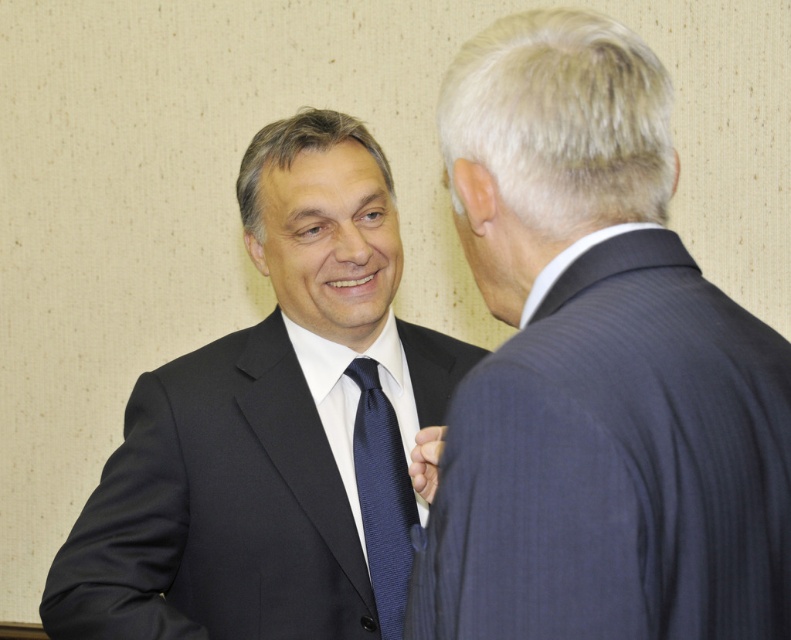
Based on the scene description, can you determine if the dark blue pinstripe suit at right is wider than the navy silk tie at center?

The dark blue pinstripe suit at right might be wider than navy silk tie at center according to the description.

You are standing in the room where the two men are talking. You need to locate the dark blue pinstripe suit at right. Where exactly should you look?

You should look at point 0.580 on the horizontal axis and point 0.755 on the vertical axis to find the dark blue pinstripe suit at right.

You are a tailor observing two men in suits. You need to determine which object is taller between the matte black suit at center and the navy silk tie at center. Which one is taller?

The matte black suit at center is taller than the navy silk tie at center.